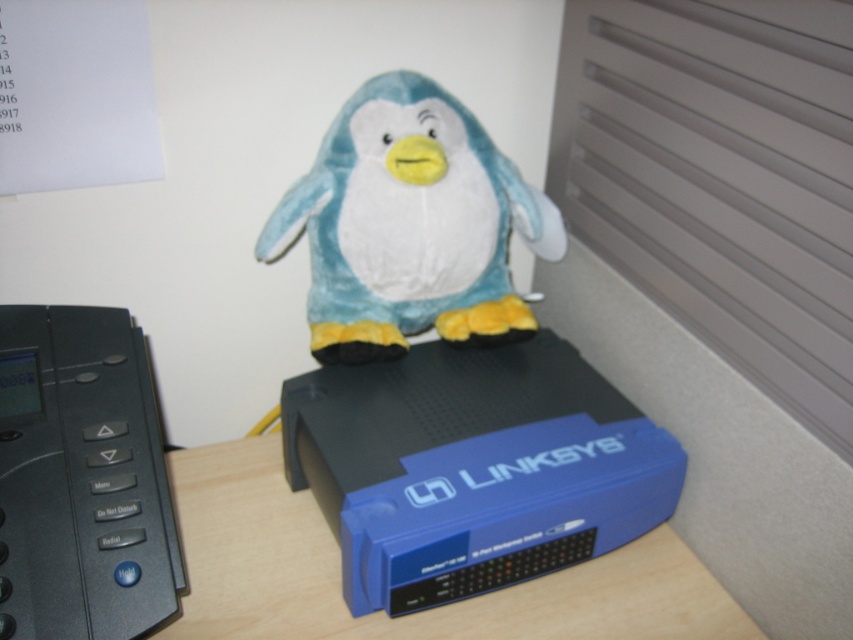
Question: Considering the relative positions of black plastic phone at left and blue plastic router at center in the image provided, where is black plastic phone at left located with respect to blue plastic router at center?

Choices:
 (A) below
 (B) above

Answer: (B)

Question: Which point is farther to the camera?

Choices:
 (A) blue plastic router at center
 (B) soft plush penguin at center
 (C) black plastic phone at left

Answer: (B)

Question: Which of the following is the closest to the observer?

Choices:
 (A) (509, 198)
 (B) (100, 330)

Answer: (B)

Question: Can you confirm if soft plush penguin at center is bigger than blue plastic router at center?

Choices:
 (A) yes
 (B) no

Answer: (B)

Question: Based on their relative distances, which object is farther from the blue plastic router at center?

Choices:
 (A) black plastic phone at left
 (B) soft plush penguin at center

Answer: (B)

Question: In this image, where is soft plush penguin at center located relative to blue plastic router at center?

Choices:
 (A) above
 (B) below

Answer: (A)